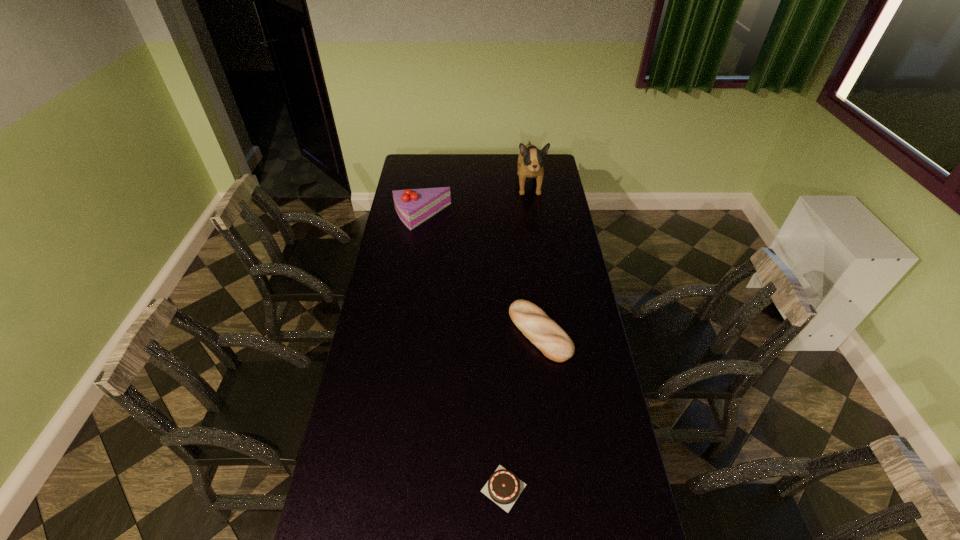
Identify the location of vacant space in between the leftmost object and the bread. (481, 274).

Locate an element on the screen. This screenshot has width=960, height=540. object that is the third nearest to the tallest object is located at coordinates 503,487.

Locate an element on the screen. object that stands as the third closest to the tallest object is located at coordinates (503, 487).

Identify the location of free space that satisfies the following two spatial constraints: 1. on the back side of the third farthest object; 2. on the left side of the shortest object. (498, 332).

Find the location of `free space that satisfies the following two spatial constraints: 1. on the front side of the bread; 2. on the right side of the leftmost object`. free space that satisfies the following two spatial constraints: 1. on the front side of the bread; 2. on the right side of the leftmost object is located at coordinates (404, 332).